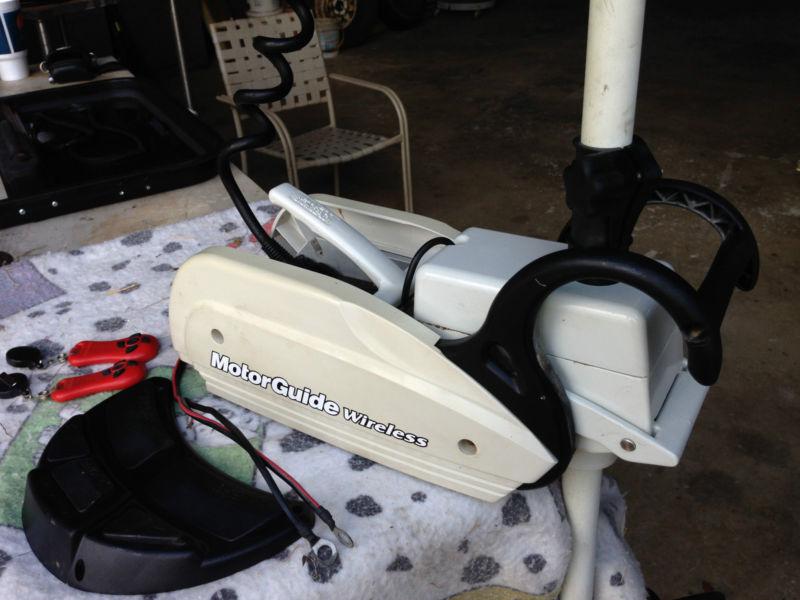
At what (x,y) coordinates should I click in order to perform the action: click on floor. Please return your answer as a coordinate pair (x, y). The width and height of the screenshot is (800, 600). Looking at the image, I should click on (482, 182).